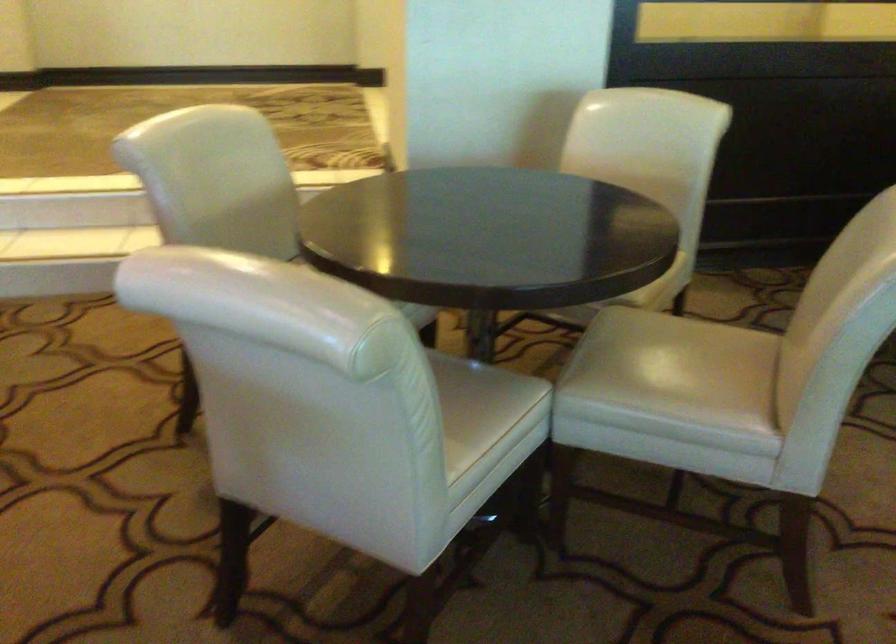
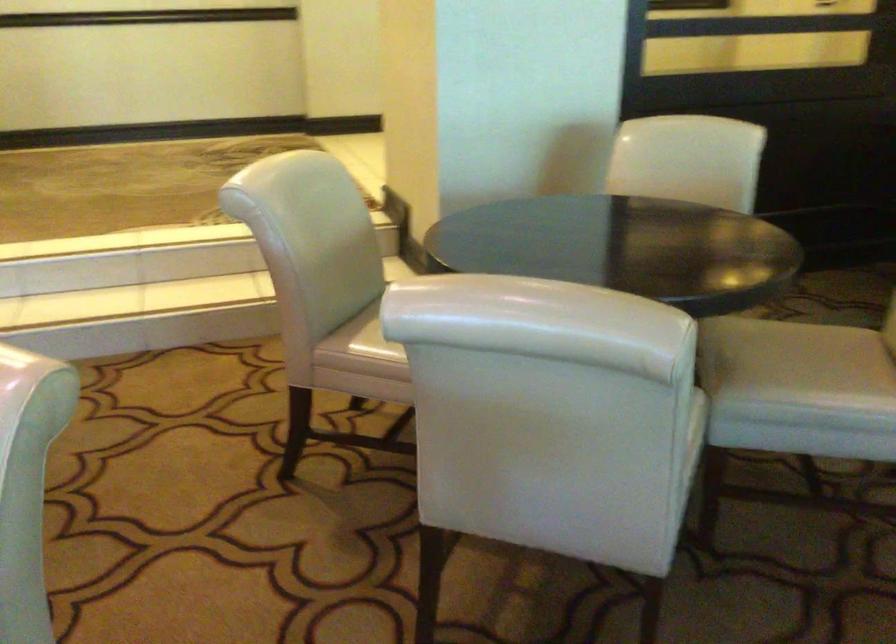
Question: The camera is either moving clockwise (left) or counter-clockwise (right) around the object. The first image is from the beginning of the video and the second image is from the end. Is the camera moving left or right when shooting the video?

Choices:
 (A) Left
 (B) Right

Answer: (A)